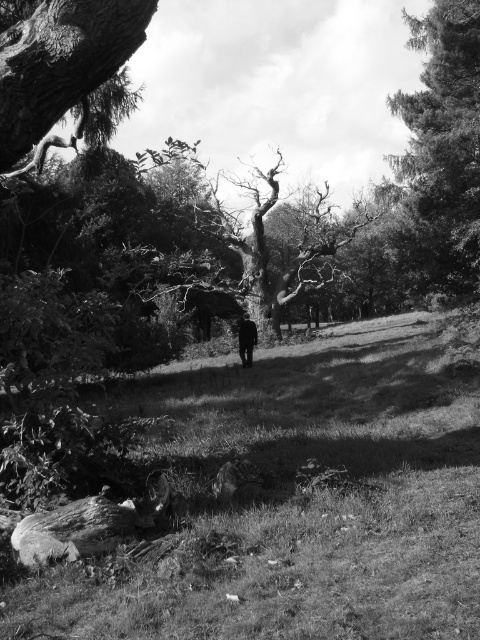
In the serene natural landscape photograph, there are two points marked as point 1 at coordinates point (x=204, y=401) and point 2 at coordinates point (x=429, y=122). From an observer standing at the bottom left corner of the image, which point is closer to them?

Point 1 at coordinates point (x=204, y=401) is closer to the observer at the bottom left corner because it is in front of point 2 at coordinates point (x=429, y=122).